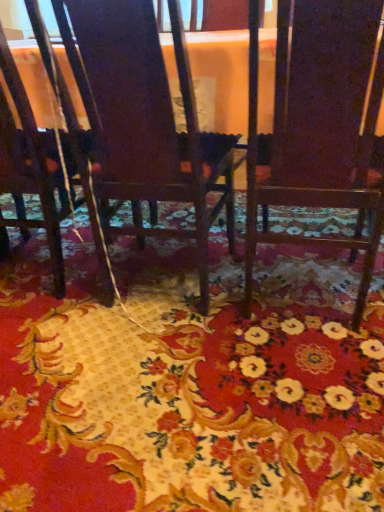
Question: Does wooden chair at center, positioned as the first chair in right-to-left order, have a lesser width compared to dark wood chair at center, arranged as the second chair when viewed from the left?

Choices:
 (A) yes
 (B) no

Answer: (A)

Question: Are wooden chair at center, which is counted as the 3th chair, starting from the left, and dark wood chair at center, arranged as the second chair when viewed from the left, making contact?

Choices:
 (A) no
 (B) yes

Answer: (A)

Question: Can you confirm if wooden chair at center, positioned as the first chair in right-to-left order, is positioned to the right of dark wood chair at center, acting as the second chair starting from the right?

Choices:
 (A) yes
 (B) no

Answer: (A)

Question: Does wooden chair at center, positioned as the first chair in right-to-left order, come behind dark wood chair at center, acting as the second chair starting from the right?

Choices:
 (A) no
 (B) yes

Answer: (A)

Question: Is wooden chair at center, which is counted as the 3th chair, starting from the left, positioned beyond the bounds of dark wood chair at center, acting as the second chair starting from the right?

Choices:
 (A) yes
 (B) no

Answer: (A)

Question: Is floral carpet at center inside or outside of wooden chair at center, positioned as the first chair in right-to-left order?

Choices:
 (A) outside
 (B) inside

Answer: (A)

Question: Visually, is floral carpet at center positioned to the left or to the right of wooden chair at center, which is counted as the 3th chair, starting from the left?

Choices:
 (A) right
 (B) left

Answer: (B)

Question: Is floral carpet at center taller or shorter than wooden chair at center, positioned as the first chair in right-to-left order?

Choices:
 (A) short
 (B) tall

Answer: (A)

Question: In the image, is floral carpet at center positioned in front of or behind wooden chair at center, positioned as the first chair in right-to-left order?

Choices:
 (A) behind
 (B) front

Answer: (B)

Question: Is point (64, 287) closer or farther from the camera than point (3, 505)?

Choices:
 (A) closer
 (B) farther

Answer: (B)

Question: In the image, is matte dark wood chair at lower left, which is counted as the first chair, starting from the left, positioned in front of or behind floral carpet at center?

Choices:
 (A) behind
 (B) front

Answer: (A)

Question: Do you think matte dark wood chair at lower left, which is counted as the first chair, starting from the left, is within floral carpet at center, or outside of it?

Choices:
 (A) inside
 (B) outside

Answer: (B)

Question: From a real-world perspective, is matte dark wood chair at lower left, which is counted as the first chair, starting from the left, positioned above or below floral carpet at center?

Choices:
 (A) above
 (B) below

Answer: (A)

Question: From their relative heights in the image, would you say dark wood chair at center, arranged as the second chair when viewed from the left, is taller or shorter than floral carpet at center?

Choices:
 (A) tall
 (B) short

Answer: (A)

Question: From the image's perspective, is dark wood chair at center, acting as the second chair starting from the right, positioned above or below floral carpet at center?

Choices:
 (A) below
 (B) above

Answer: (B)